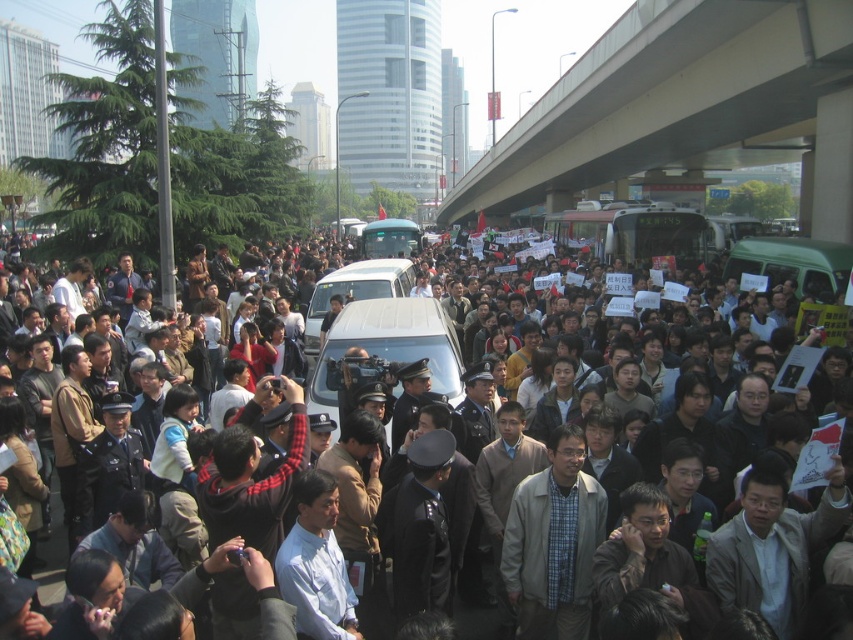
Who is more distant from viewer, (805, 132) or (287, 516)?

Point (805, 132)

Can you confirm if concrete bridge at upper right is wider than dark gray uniformed officers at center?

Yes, concrete bridge at upper right is wider than dark gray uniformed officers at center.

Locate an element on the screen. This screenshot has width=853, height=640. concrete bridge at upper right is located at coordinates (685, 108).